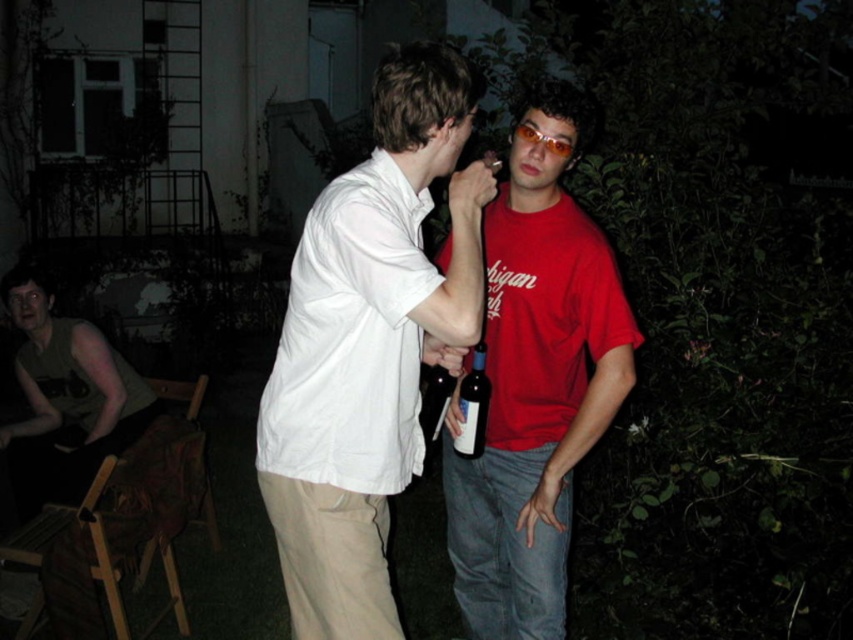
Can you confirm if matte khaki pants at center is positioned below matte red t-shirt at center?

No.

Who is lower down, matte khaki pants at center or matte red t-shirt at center?

matte red t-shirt at center is lower down.

Is point (355, 328) farther from camera compared to point (589, 129)?

That is False.

This screenshot has height=640, width=853. I want to click on matte khaki pants at center, so point(369,344).

How distant is white cotton shirt at center from dark blue glass bottle at center?

They are 15.60 inches apart.

Who is higher up, white cotton shirt at center or dark blue glass bottle at center?

white cotton shirt at center is above.

Identify the location of white cotton shirt at center. Image resolution: width=853 pixels, height=640 pixels. (351, 339).

Between matte red t-shirt at center and matte green t-shirt at lower left, which one is positioned higher?

matte red t-shirt at center

Which is below, matte red t-shirt at center or matte green t-shirt at lower left?

matte green t-shirt at lower left is lower down.

Where is `matte red t-shirt at center`? matte red t-shirt at center is located at coordinates (537, 378).